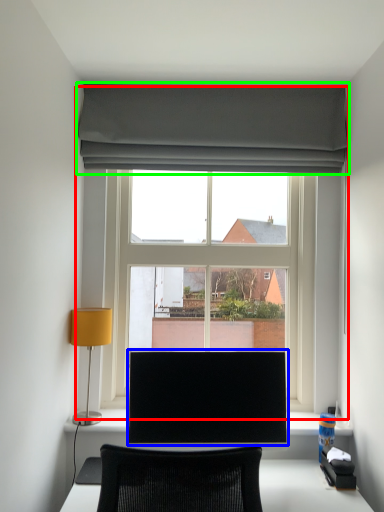
Question: Which object is the closest to the window (highlighted by a red box)? Choose among these: computer monitor (highlighted by a blue box) or curtain (highlighted by a green box).

Choices:
 (A) computer monitor
 (B) curtain

Answer: (B)